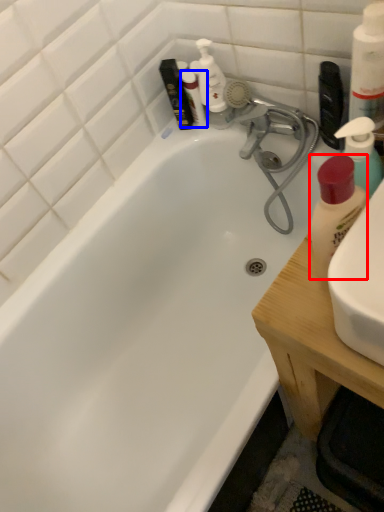
Question: Which object is closer to the camera taking this photo, cleaning product (highlighted by a red box) or toiletry (highlighted by a blue box)?

Choices:
 (A) cleaning product
 (B) toiletry

Answer: (A)